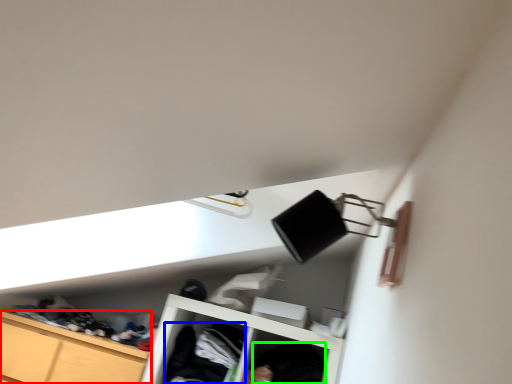
Question: Which object is positioned farthest from cabinetry (highlighted by a red box)? Select from clothing (highlighted by a blue box) and clothing (highlighted by a green box).

Choices:
 (A) clothing
 (B) clothing

Answer: (B)